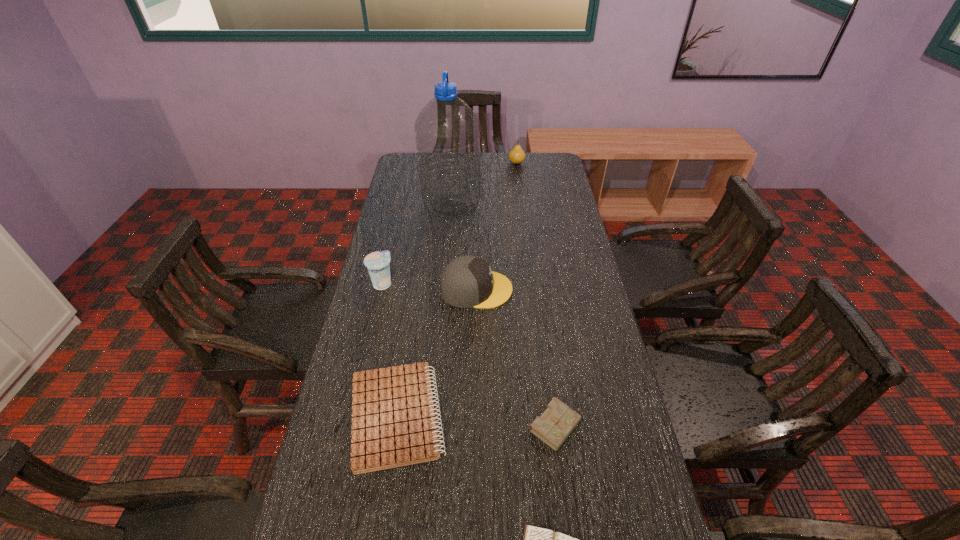
This screenshot has height=540, width=960. Identify the location of water jug. (447, 131).

Locate an element on the screen. Image resolution: width=960 pixels, height=540 pixels. the second farthest object is located at coordinates tap(447, 131).

The width and height of the screenshot is (960, 540). Identify the location of the farthest object. (517, 155).

Image resolution: width=960 pixels, height=540 pixels. In order to click on yogurt in this screenshot , I will do `click(378, 263)`.

What are the coordinates of `cap` in the screenshot? It's located at pos(468,281).

The height and width of the screenshot is (540, 960). Find the location of `the third shortest object`. the third shortest object is located at coordinates (553, 427).

Locate an element on the screen. the farther diary is located at coordinates (553, 427).

Identify the location of the sixth tallest object. (393, 420).

The image size is (960, 540). Find the location of `blank area located on the right of the tallest object`. blank area located on the right of the tallest object is located at coordinates (537, 205).

Identify the location of vacant space located 0.230m on the front of the farthest object. (520, 194).